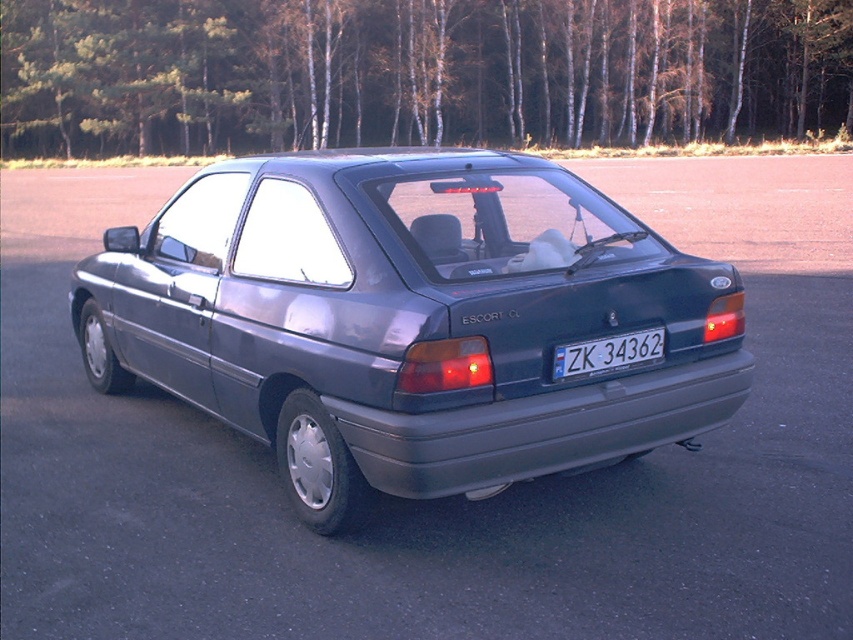
Is satin metallic car at center below white plastic license plate at center?

Actually, satin metallic car at center is above white plastic license plate at center.

Based on the photo, can you confirm if satin metallic car at center is thinner than white plastic license plate at center?

In fact, satin metallic car at center might be wider than white plastic license plate at center.

Which is behind, point (682, 380) or point (607, 358)?

The point (682, 380) is behind.

Where is `satin metallic car at center`? The width and height of the screenshot is (853, 640). satin metallic car at center is located at coordinates (410, 321).